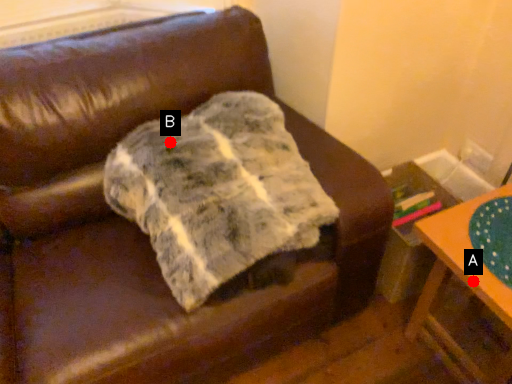
Question: Two points are circled on the image, labeled by A and B beside each circle. Which point appears closest to the camera in this image?

Choices:
 (A) A is closer
 (B) B is closer

Answer: (A)